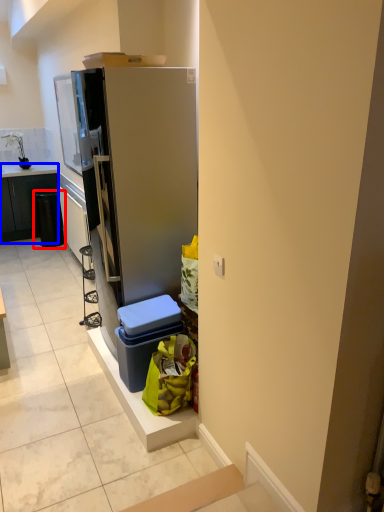
Question: Among these objects, which one is nearest to the camera, recycling bin (highlighted by a red box) or cabinetry (highlighted by a blue box)?

Choices:
 (A) recycling bin
 (B) cabinetry

Answer: (A)